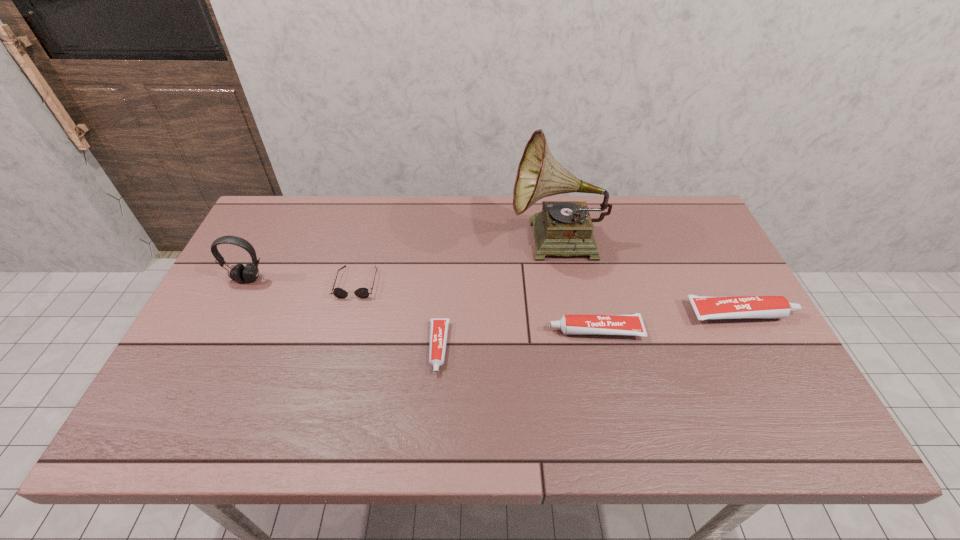
Find the location of `vacant region between the tallest object and the leftmost object`. vacant region between the tallest object and the leftmost object is located at coordinates (402, 260).

Find the location of a particular element. The height and width of the screenshot is (540, 960). free space between the leftmost object and the rightmost toothpaste is located at coordinates (494, 296).

At what (x,y) coordinates should I click in order to perform the action: click on free space between the second tallest toothpaste and the fourth object from right to left. Please return your answer as a coordinate pair (x, y). This screenshot has width=960, height=540. Looking at the image, I should click on (516, 339).

Find the location of a particular element. vacant point located between the second tallest toothpaste and the leftmost object is located at coordinates (421, 305).

Locate an element on the screen. The image size is (960, 540). vacant area that lies between the second object from left to right and the rightmost object is located at coordinates (549, 298).

I want to click on free area in between the third shortest object and the tallest object, so click(576, 286).

Where is `vacant space in between the rightmost object and the second tallest object`? vacant space in between the rightmost object and the second tallest object is located at coordinates (494, 296).

Identify the location of vacant space in between the shortest object and the record player. (497, 295).

In order to click on vacant area that lies between the tallest object and the rightmost object in this screenshot , I will do `click(649, 278)`.

Identify the location of the third closest object to the headset. (565, 228).